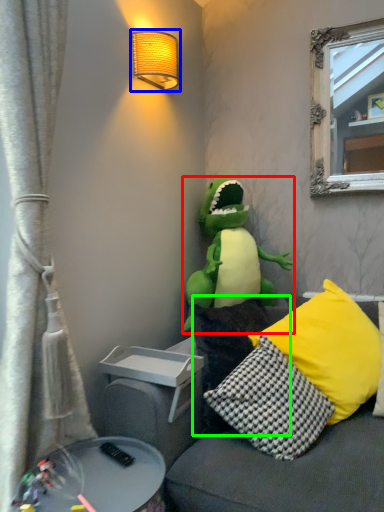
Question: Considering the real-world distances, which object is farthest from toy (highlighted by a red box)? lamp (highlighted by a blue box) or pillow (highlighted by a green box)?

Choices:
 (A) lamp
 (B) pillow

Answer: (A)